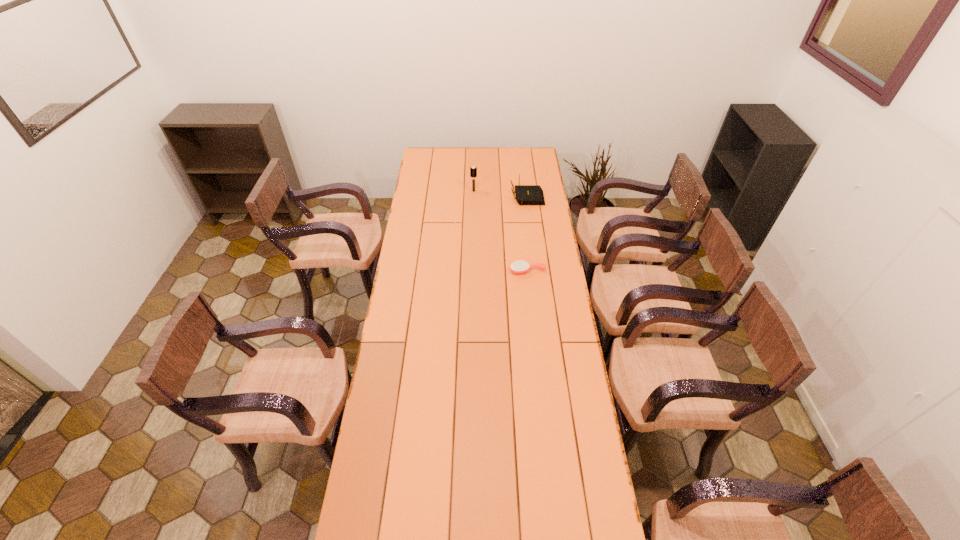
The width and height of the screenshot is (960, 540). In order to click on the closest object to the leftmost object in this screenshot , I will do `click(525, 194)`.

Point out which object is positioned as the second nearest to the shorter hairbrush. Please provide its 2D coordinates. Your answer should be formatted as a tuple, i.e. [(x, y)], where the tuple contains the x and y coordinates of a point satisfying the conditions above.

[(473, 170)]

The image size is (960, 540). I want to click on hairbrush that is the closest to the second tallest object, so click(x=473, y=170).

At what (x,y) coordinates should I click in order to perform the action: click on free space that satisfies the following two spatial constraints: 1. on the front side of the router; 2. on the left side of the left hairbrush. Please return your answer as a coordinate pair (x, y). The width and height of the screenshot is (960, 540). Looking at the image, I should click on (473, 197).